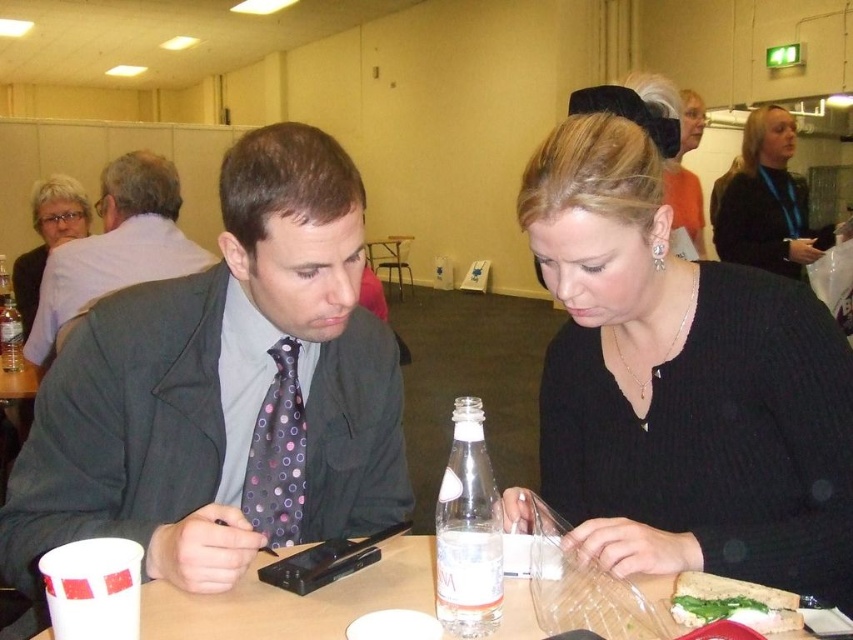
Question: Is clear glass bottle at center wider than transparent plastic bottle at center?

Choices:
 (A) yes
 (B) no

Answer: (B)

Question: Which point appears farthest from the camera in this image?

Choices:
 (A) (189, 598)
 (B) (438, 548)

Answer: (A)

Question: Which object is positioned farthest from the dark gray wool suit at left?

Choices:
 (A) black sweater at upper right
 (B) dark gray suit at left

Answer: (A)

Question: Where is white plastic table at center located in relation to green leafy sandwich at lower right in the image?

Choices:
 (A) above
 (B) below

Answer: (B)

Question: Which point appears closest to the camera in this image?

Choices:
 (A) (346, 189)
 (B) (16, 365)

Answer: (A)

Question: Is black sweater at upper right to the left of clear glass bottle at center from the viewer's perspective?

Choices:
 (A) yes
 (B) no

Answer: (B)